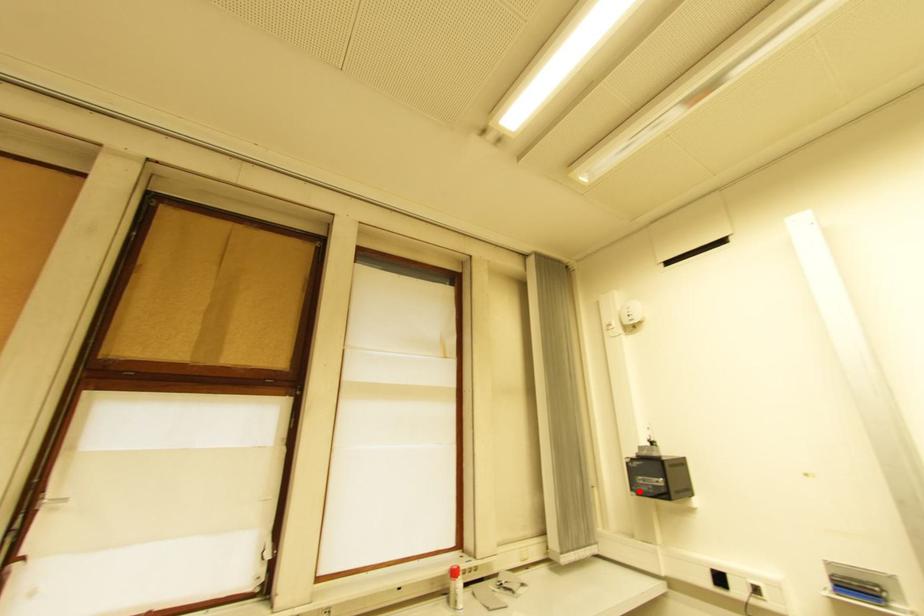
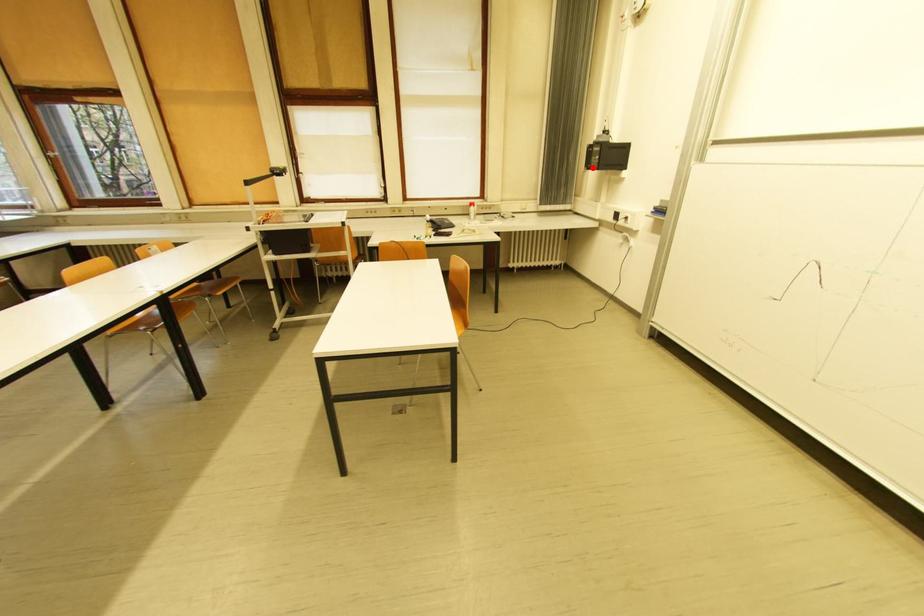
I am providing you with two images of the same scene from different viewpoints. A red point is marked on the first image and another point is marked on the second image. Do the highlighted points in image1 and image2 indicate the same real-world spot?

Yes